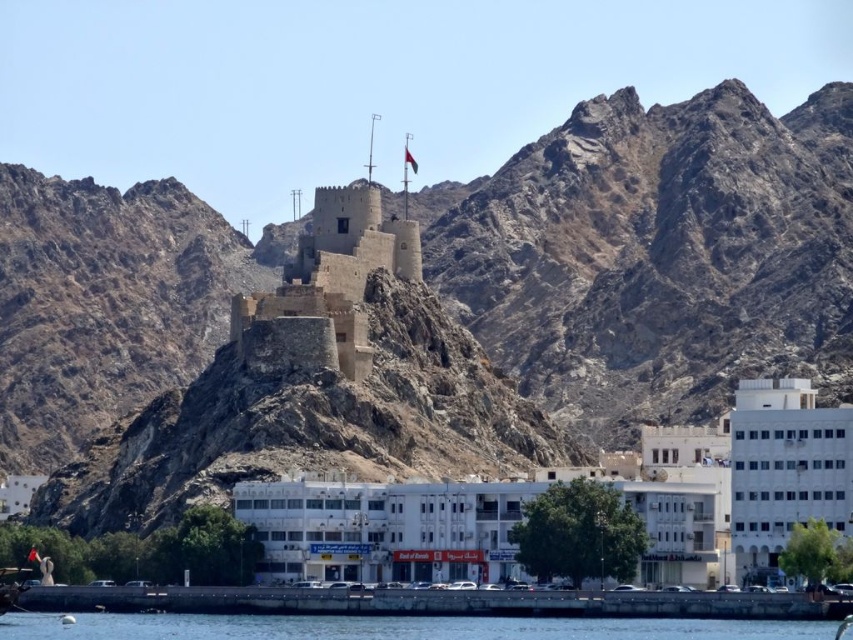
Who is shorter, brown stone castle at center or black fabric flag at upper center?

With less height is black fabric flag at upper center.

Who is lower down, brown stone castle at center or black fabric flag at upper center?

brown stone castle at center

Which is behind, point (338, 221) or point (410, 157)?

The point (410, 157) is more distant.

You are a GUI agent. You are given a task and a screenshot of the screen. Output one action in this format:
    pyautogui.click(x=<x>, y=<y>)
    Task: Click on the brown stone castle at center
    The image size is (853, 640).
    Given the screenshot: What is the action you would take?
    pyautogui.click(x=338, y=269)

Is brown rocky mountain at center to the right of clear water at lower center from the viewer's perspective?

Correct, you'll find brown rocky mountain at center to the right of clear water at lower center.

Who is lower down, brown rocky mountain at center or clear water at lower center?

clear water at lower center

Which is behind, point (724, 100) or point (805, 632)?

Point (724, 100)

Where is `brown rocky mountain at center`? brown rocky mountain at center is located at coordinates (654, 256).

Is clear water at lower center positioned before black fabric flag at upper center?

Yes.

Image resolution: width=853 pixels, height=640 pixels. Describe the element at coordinates (395, 627) in the screenshot. I see `clear water at lower center` at that location.

This screenshot has width=853, height=640. What are the coordinates of `clear water at lower center` in the screenshot? It's located at (395, 627).